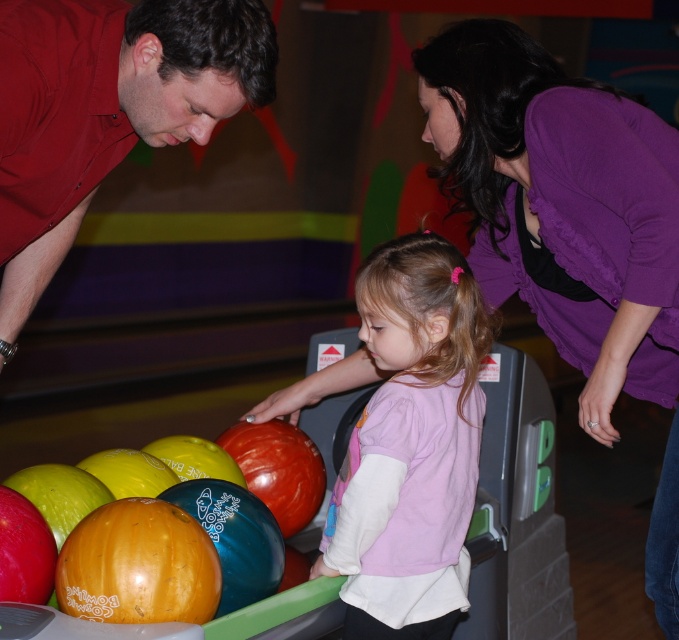
Question: Which point appears closest to the camera in this image?

Choices:
 (A) (534, 196)
 (B) (422, 596)

Answer: (B)

Question: Is purple fabric shirt at upper right wider than pink fabric shirt at center?

Choices:
 (A) yes
 (B) no

Answer: (A)

Question: Is purple fabric shirt at upper right thinner than pink fabric shirt at center?

Choices:
 (A) yes
 (B) no

Answer: (B)

Question: Which object appears closest to the camera in this image?

Choices:
 (A) pink fabric shirt at center
 (B) purple fabric shirt at upper right

Answer: (A)

Question: Is purple fabric shirt at upper right above pink fabric shirt at center?

Choices:
 (A) no
 (B) yes

Answer: (B)